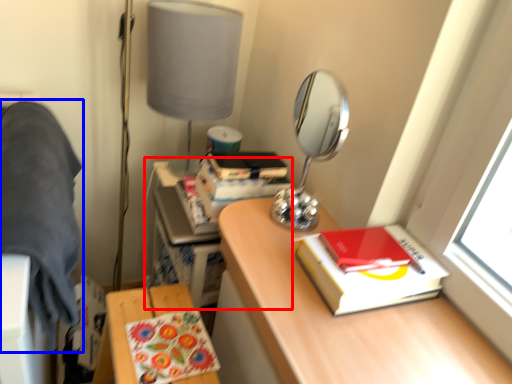
Question: Which point is closer to the camera, computer desk (highlighted by a red box) or bedding (highlighted by a blue box)?

Choices:
 (A) computer desk
 (B) bedding

Answer: (B)